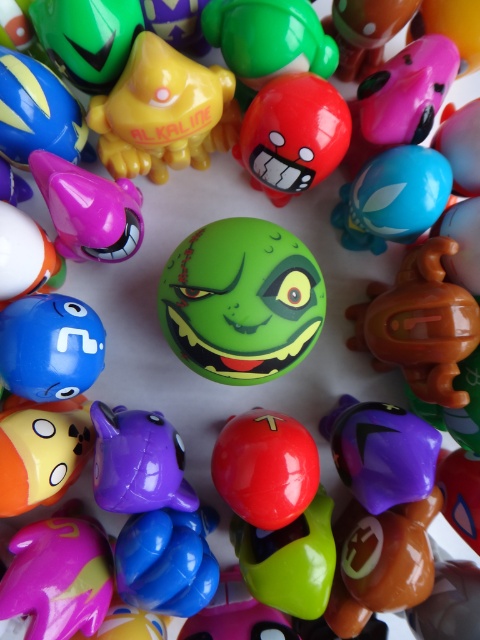
Can you confirm if matte plastic toy at center is wider than matte green plastic toy at upper left?

Indeed, matte plastic toy at center has a greater width compared to matte green plastic toy at upper left.

You are a GUI agent. You are given a task and a screenshot of the screen. Output one action in this format:
    pyautogui.click(x=<x>, y=<y>)
    Task: Click on the matte plastic toy at center
    Image resolution: width=480 pixels, height=640 pixels.
    Given the screenshot: What is the action you would take?
    pyautogui.click(x=292, y=134)

Can you confirm if green matte ball at center is positioned above blue matte ball at center?

Yes.

Which is in front, point (204, 337) or point (72, 384)?

Point (204, 337) is more forward.

Where is `green matte ball at center`? green matte ball at center is located at coordinates (240, 300).

Is green matte ball at center thinner than yellow matte cat at upper left?

No, green matte ball at center is not thinner than yellow matte cat at upper left.

Which of these two, green matte ball at center or yellow matte cat at upper left, stands shorter?

yellow matte cat at upper left

Who is more forward, (284,260) or (124,74)?

Point (284,260)

Where is `green matte ball at center`? Image resolution: width=480 pixels, height=640 pixels. green matte ball at center is located at coordinates (240, 300).